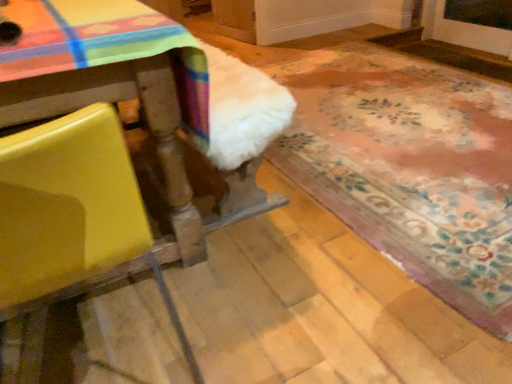
Question: Can you confirm if white fluffy rug at lower right is taller than yellow matte chair at left?

Choices:
 (A) yes
 (B) no

Answer: (B)

Question: Is the depth of white fluffy rug at lower right less than that of yellow matte chair at left?

Choices:
 (A) yes
 (B) no

Answer: (B)

Question: From a real-world perspective, is white fluffy rug at lower right over yellow matte chair at left?

Choices:
 (A) yes
 (B) no

Answer: (B)

Question: Would you say white fluffy rug at lower right is outside yellow matte chair at left?

Choices:
 (A) no
 (B) yes

Answer: (B)

Question: Is white fluffy rug at lower right to the left of yellow matte chair at left from the viewer's perspective?

Choices:
 (A) no
 (B) yes

Answer: (A)

Question: Is white fluffy rug at lower right looking in the opposite direction of yellow matte chair at left?

Choices:
 (A) yes
 (B) no

Answer: (B)

Question: Is yellow matte chair at left aimed at white fluffy rug at lower right?

Choices:
 (A) no
 (B) yes

Answer: (A)

Question: From the image's perspective, is yellow matte chair at left under white fluffy rug at lower right?

Choices:
 (A) no
 (B) yes

Answer: (B)

Question: From a real-world perspective, does yellow matte chair at left sit lower than white fluffy rug at lower right?

Choices:
 (A) no
 (B) yes

Answer: (A)

Question: Is yellow matte chair at left located outside white fluffy rug at lower right?

Choices:
 (A) no
 (B) yes

Answer: (B)

Question: Is yellow matte chair at left not near white fluffy rug at lower right?

Choices:
 (A) yes
 (B) no

Answer: (A)

Question: Is yellow matte chair at left at the right side of white fluffy rug at lower right?

Choices:
 (A) yes
 (B) no

Answer: (B)

Question: Considering their positions, is yellow matte chair at left located in front of or behind white fluffy rug at lower right?

Choices:
 (A) front
 (B) behind

Answer: (A)